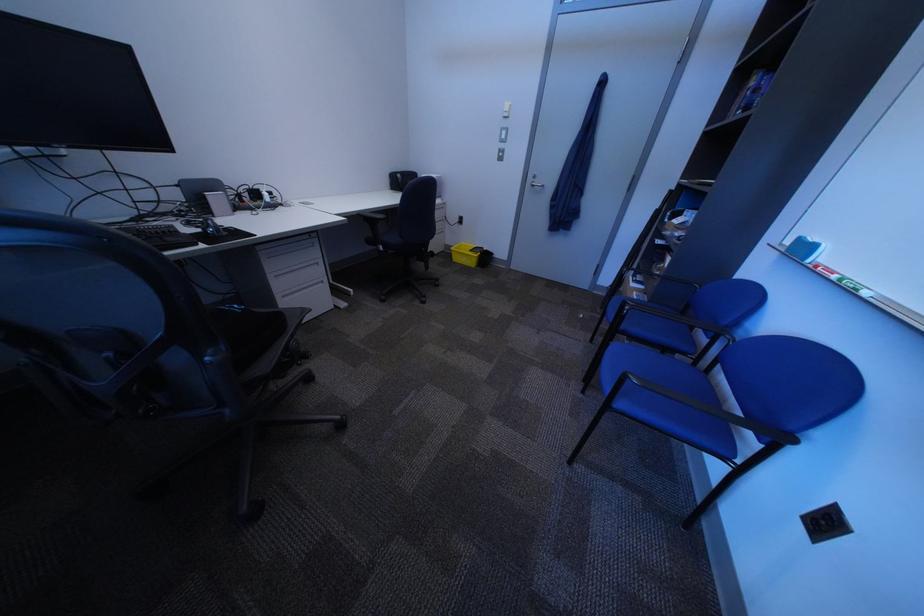
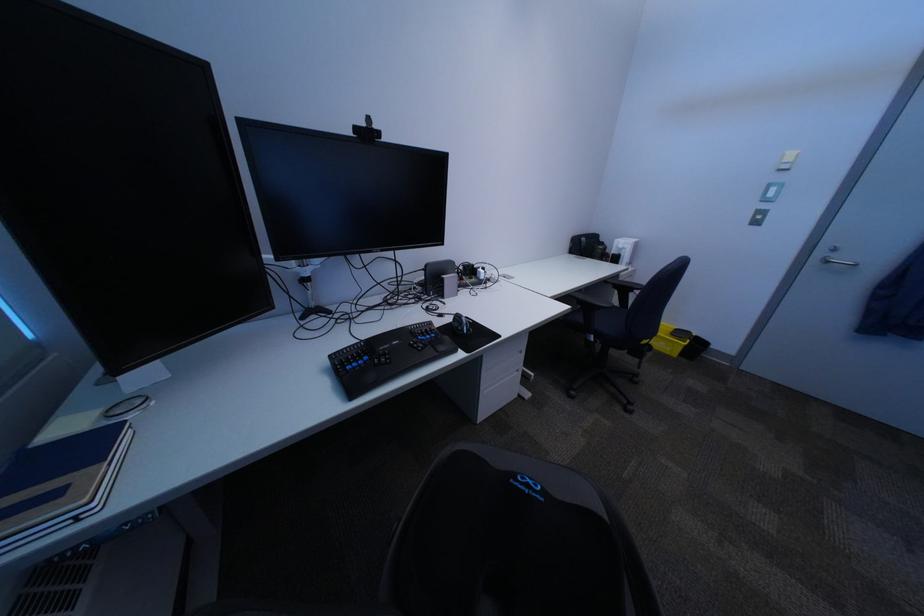
Where in the second image is the point corresponding to point (201, 230) from the first image?

(454, 325)